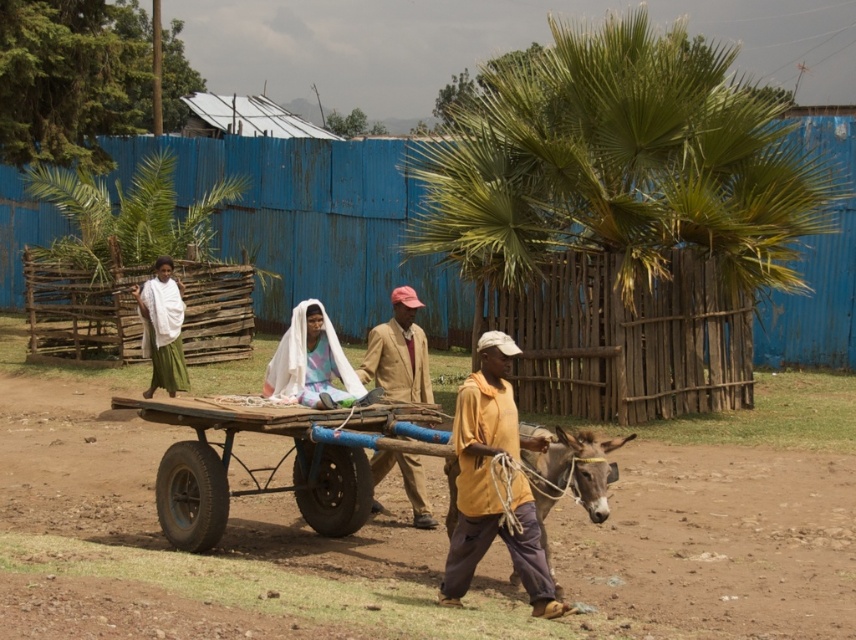
You are a traveler who wants to borrow a jacket from the beige fabric jacket at center to stay warm. Can you reach it without moving the white sheer cloth at center?

The beige fabric jacket at center is positioned over the white sheer cloth at center, so you can reach the beige fabric jacket at center without moving the white sheer cloth at center.

You are a photographer trying to capture the entire wooden cart at center and the yellow matte shirt at center in one frame. Given that your camera can only focus on objects within a 1.5 meter width, will both objects fit in the frame?

The wooden cart at center is larger in size than yellow matte shirt at center. Since the cart is bigger, it might exceed the 1.5 meter width frame. However, without exact measurements, it is uncertain. But according to the description, the cart is larger, so it may not fit entirely within the 1.5 meter width. Therefore, both objects might not fit in the frame.